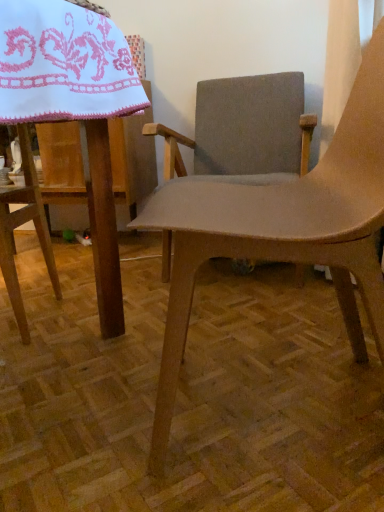
Question: Is matte brown chair at center, the second chair positioned from the back, not near white embroidered cloth at upper left?

Choices:
 (A) no
 (B) yes

Answer: (A)

Question: Does matte brown chair at center, the second chair positioned from the back, have a greater height compared to white embroidered cloth at upper left?

Choices:
 (A) yes
 (B) no

Answer: (A)

Question: Is matte brown chair at center, the 1th chair when ordered from front to back, shorter than white embroidered cloth at upper left?

Choices:
 (A) yes
 (B) no

Answer: (B)

Question: From a real-world perspective, is matte brown chair at center, the second chair positioned from the back, on white embroidered cloth at upper left?

Choices:
 (A) no
 (B) yes

Answer: (A)

Question: Is matte brown chair at center, the second chair positioned from the back, facing towards white embroidered cloth at upper left?

Choices:
 (A) no
 (B) yes

Answer: (B)

Question: Is matte brown chair at center, the 1th chair when ordered from front to back, taller or shorter than white embroidered cloth at upper left?

Choices:
 (A) tall
 (B) short

Answer: (A)

Question: From the image's perspective, is matte brown chair at center, the 1th chair when ordered from front to back, located above or below white embroidered cloth at upper left?

Choices:
 (A) above
 (B) below

Answer: (B)

Question: From a real-world perspective, is matte brown chair at center, the second chair positioned from the back, above or below white embroidered cloth at upper left?

Choices:
 (A) above
 (B) below

Answer: (B)

Question: In terms of size, does matte brown chair at center, the 1th chair when ordered from front to back, appear bigger or smaller than white embroidered cloth at upper left?

Choices:
 (A) big
 (B) small

Answer: (A)

Question: Is matte brown chair at center, the 1th chair when ordered from front to back, to the left or to the right of textured gray fabric chair at center, the first chair when ordered from back to front, in the image?

Choices:
 (A) left
 (B) right

Answer: (A)

Question: Is matte brown chair at center, the second chair positioned from the back, wider or thinner than textured gray fabric chair at center, arranged as the second chair when viewed from the front?

Choices:
 (A) thin
 (B) wide

Answer: (A)

Question: From a real-world perspective, is matte brown chair at center, the 1th chair when ordered from front to back, physically located above or below textured gray fabric chair at center, arranged as the second chair when viewed from the front?

Choices:
 (A) below
 (B) above

Answer: (A)

Question: From their relative heights in the image, would you say matte brown chair at center, the 1th chair when ordered from front to back, is taller or shorter than textured gray fabric chair at center, the first chair when ordered from back to front?

Choices:
 (A) tall
 (B) short

Answer: (A)

Question: From a real-world perspective, relative to textured gray fabric chair at center, the first chair when ordered from back to front, is white embroidered cloth at upper left vertically above or below?

Choices:
 (A) below
 (B) above

Answer: (B)

Question: From the image's perspective, is white embroidered cloth at upper left located above or below textured gray fabric chair at center, arranged as the second chair when viewed from the front?

Choices:
 (A) below
 (B) above

Answer: (A)